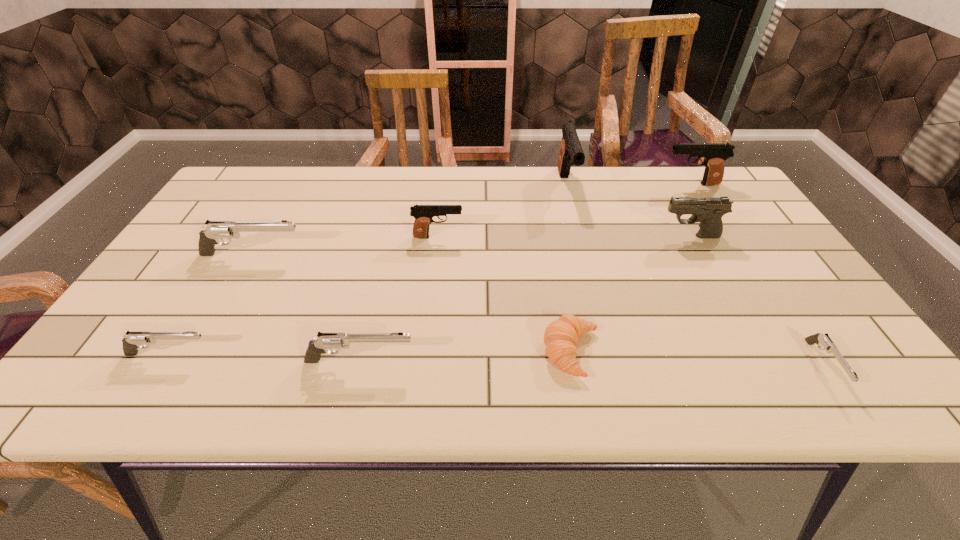
Where is `free space that satisfies the following two spatial constraints: 1. on the back side of the crescent roll; 2. on the front-facing side of the biggest silver pistol`? Image resolution: width=960 pixels, height=540 pixels. free space that satisfies the following two spatial constraints: 1. on the back side of the crescent roll; 2. on the front-facing side of the biggest silver pistol is located at coordinates (554, 255).

Locate an element on the screen. vacant space that satisfies the following two spatial constraints: 1. on the front-facing side of the crescent roll; 2. on the left side of the biggest silver pistol is located at coordinates (199, 352).